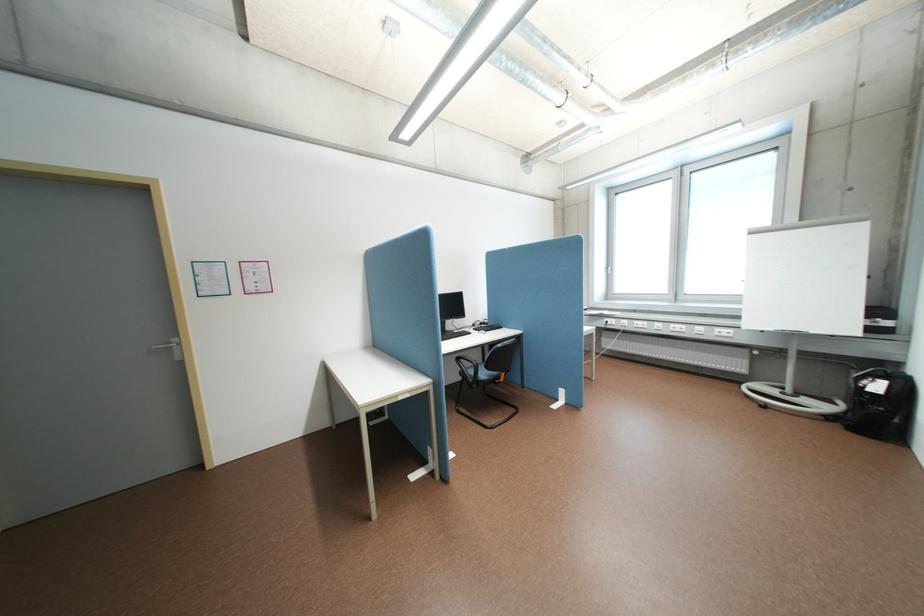
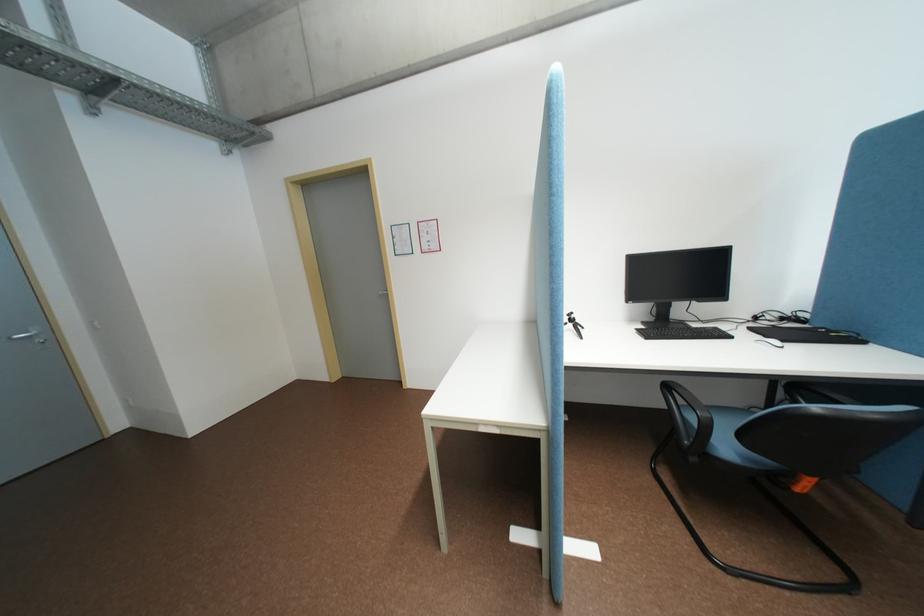
In the second image, find the point that corresponds to point (497, 367) in the first image.

(755, 437)